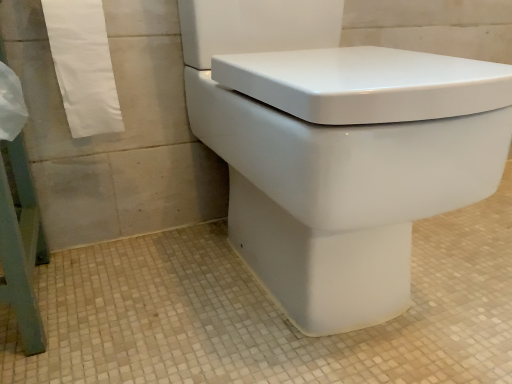
What do you see at coordinates (83, 66) in the screenshot?
I see `white paper towel at left` at bounding box center [83, 66].

Locate an element on the screen. The height and width of the screenshot is (384, 512). white paper towel at left is located at coordinates (83, 66).

Where is `white glossy toilet at center`? This screenshot has width=512, height=384. white glossy toilet at center is located at coordinates (347, 166).

The width and height of the screenshot is (512, 384). What do you see at coordinates (347, 166) in the screenshot?
I see `white glossy toilet at center` at bounding box center [347, 166].

Where is `white paper towel at left`? This screenshot has width=512, height=384. white paper towel at left is located at coordinates (83, 66).

Between white paper towel at left and white glossy toilet at center, which one appears on the left side from the viewer's perspective?

From the viewer's perspective, white paper towel at left appears more on the left side.

Is white paper towel at left closer to camera compared to white glossy toilet at center?

That is False.

Does point (92, 54) come farther from viewer compared to point (332, 304)?

Yes, it is.

From the image's perspective, between white paper towel at left and white glossy toilet at center, which one is located above?

white paper towel at left, from the image's perspective.

From a real-world perspective, is white paper towel at left positioned under white glossy toilet at center based on gravity?

No, from a real-world perspective, white paper towel at left is not below white glossy toilet at center.

Is white paper towel at left wider than white glossy toilet at center?

In fact, white paper towel at left might be narrower than white glossy toilet at center.

Looking at this image, can you confirm if white paper towel at left is taller than white glossy toilet at center?

No, white paper towel at left is not taller than white glossy toilet at center.

Is white paper towel at left bigger than white glossy toilet at center?

Actually, white paper towel at left might be smaller than white glossy toilet at center.

Is white glossy toilet at center surrounded by white paper towel at left?

No, white glossy toilet at center is located outside of white paper towel at left.

Can you see white paper towel at left touching white glossy toilet at center?

No, white paper towel at left is not touching white glossy toilet at center.

Looking at this image, could you tell me if white paper towel at left is facing white glossy toilet at center?

No, white paper towel at left is not turned towards white glossy toilet at center.

Based on the photo, how many degrees apart are the facing directions of white paper towel at left and white glossy toilet at center?

The angle between the facing direction of white paper towel at left and the facing direction of white glossy toilet at center is 0.773 degrees.

How far apart are white paper towel at left and white glossy toilet at center?

white paper towel at left is 16.96 inches from white glossy toilet at center.

In the image, there is a white paper towel at left. What are the coordinates of `toilet below it (from a real-world perspective)` in the screenshot? It's located at (347, 166).

Based on the photo, between white glossy toilet at center and white paper towel at left, which one appears on the left side from the viewer's perspective?

Positioned to the left is white paper towel at left.

Is white glossy toilet at center behind white paper towel at left?

No, white glossy toilet at center is closer to the camera.

Considering the positions of points (358, 117) and (97, 27), is point (358, 117) closer to camera compared to point (97, 27)?

Yes, it is.

From the image's perspective, between white glossy toilet at center and white paper towel at left, who is located below?

white glossy toilet at center appears lower in the image.

From a real-world perspective, who is located higher, white glossy toilet at center or white paper towel at left?

white paper towel at left is physically above.

Does white glossy toilet at center have a greater width compared to white paper towel at left?

Yes, white glossy toilet at center is wider than white paper towel at left.

Does white glossy toilet at center have a lesser height compared to white paper towel at left?

Incorrect, the height of white glossy toilet at center does not fall short of that of white paper towel at left.

Based on the photo, considering the sizes of objects white glossy toilet at center and white paper towel at left in the image provided, who is smaller, white glossy toilet at center or white paper towel at left?

white paper towel at left.

Is white glossy toilet at center positioned beyond the bounds of white paper towel at left?

Yes, white glossy toilet at center is outside of white paper towel at left.

From the picture: Can you see white glossy toilet at center touching white paper towel at left?

No.

Based on the photo, is white glossy toilet at center oriented away from white paper towel at left?

No.

How much distance is there between white glossy toilet at center and white paper towel at left?

white glossy toilet at center and white paper towel at left are 43.08 centimeters apart from each other.

Identify the location of bath towel above the white glossy toilet at center (from a real-world perspective). (83, 66).

Where is `toilet that is in front of the white paper towel at left`? This screenshot has width=512, height=384. toilet that is in front of the white paper towel at left is located at coordinates (347, 166).

Find the location of a particular element. This screenshot has height=384, width=512. bath towel above the white glossy toilet at center (from a real-world perspective) is located at coordinates (83, 66).